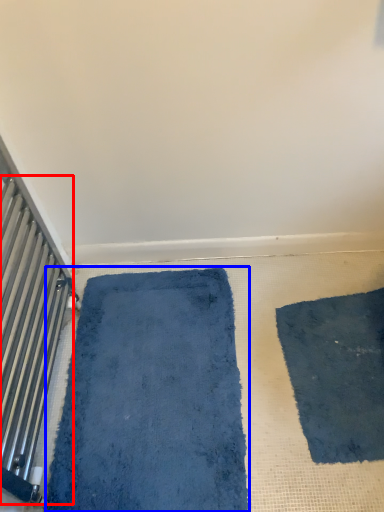
Question: Which object appears farthest to the camera in this image, radiator (highlighted by a red box) or bath mat (highlighted by a blue box)?

Choices:
 (A) radiator
 (B) bath mat

Answer: (B)